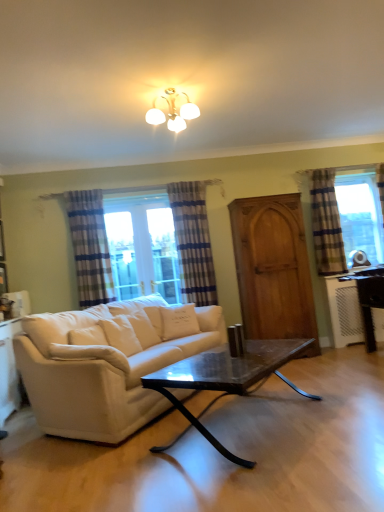
Question: From a real-world perspective, relative to blue striped curtain at center, which ranks as the 2th curtain in right-to-left order, is wooden screen door at center vertically above or below?

Choices:
 (A) below
 (B) above

Answer: (A)

Question: In terms of height, does wooden screen door at center look taller or shorter compared to blue striped curtain at center, which ranks as the 2th curtain in right-to-left order?

Choices:
 (A) short
 (B) tall

Answer: (B)

Question: Based on their relative distances, which object is nearer to the white glossy cabinet at lower left?

Choices:
 (A) white fabric couch at center
 (B) marble black coffee table at center
 (C) white glossy light fixture at upper center
 (D) striped fabric curtain at left, the third curtain from the right
 (E) blue striped curtain at right, acting as the 1th curtain starting from the right

Answer: (A)

Question: Which of these objects is positioned farthest from the wooden screen door at center?

Choices:
 (A) striped fabric curtain at left, the third curtain from the right
 (B) white plush pillow at center, the second pillow in the right-to-left sequence
 (C) marble black coffee table at center
 (D) white fabric couch at center
 (E) blue striped curtain at center, the second curtain from the left

Answer: (B)